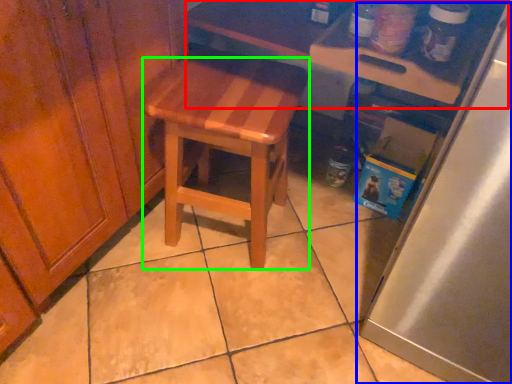
Question: Which object is positioned farthest from table (highlighted by a red box)? Select from appliance (highlighted by a blue box) and stool (highlighted by a green box).

Choices:
 (A) appliance
 (B) stool

Answer: (A)